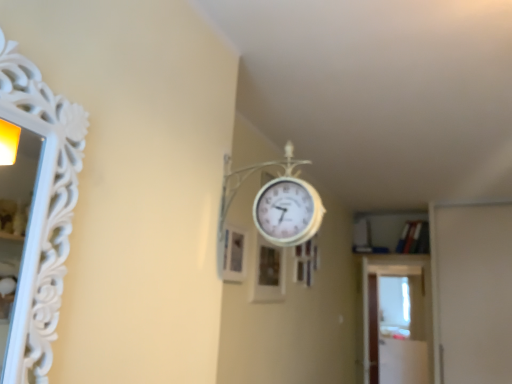
What is the approximate height of transparent glass door at center?

It is 1.42 meters.

Locate an element on the screen. The width and height of the screenshot is (512, 384). transparent glass door at center is located at coordinates (397, 321).

The height and width of the screenshot is (384, 512). What do you see at coordinates (397, 321) in the screenshot?
I see `transparent glass door at center` at bounding box center [397, 321].

You are a GUI agent. You are given a task and a screenshot of the screen. Output one action in this format:
    pyautogui.click(x=<x>, y=<y>)
    Task: Click on the transparent glass door at center
    
    Given the screenshot: What is the action you would take?
    pyautogui.click(x=397, y=321)